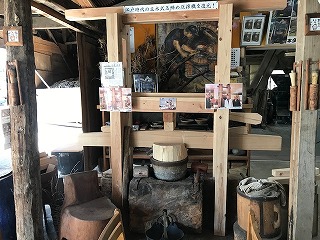
At what (x,y) coordinates should I click in order to perform the action: click on wall photograph. Please return your answer as a coordinate pair (x, y). Looking at the image, I should click on (118, 97), (168, 105), (223, 97), (13, 37), (111, 71), (317, 24).